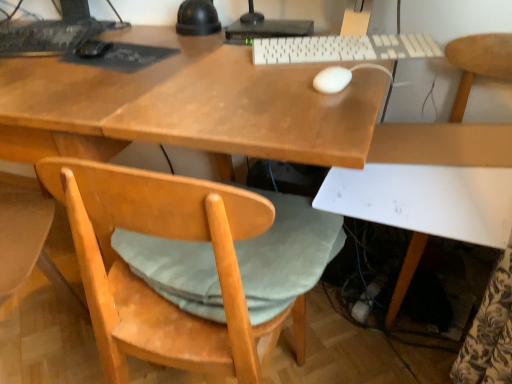
Find the location of a particular element. vacant area that lies between black matte mouse at upper left, which ranks as the first mouse in top-to-bottom order, and white matte mouse at center, which is the 2th mouse from back to front is located at coordinates (223, 67).